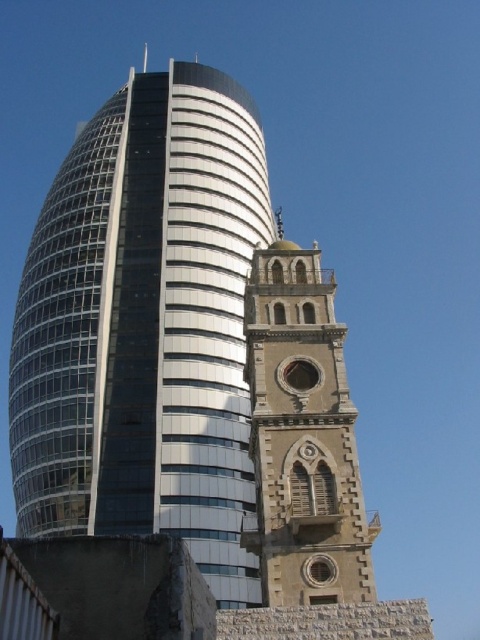
Between stone textured bell tower at center and stone gothic bell tower at center, which one appears on the right side from the viewer's perspective?

From the viewer's perspective, stone gothic bell tower at center appears more on the right side.

Is stone textured bell tower at center to the right of stone gothic bell tower at center from the viewer's perspective?

Incorrect, stone textured bell tower at center is not on the right side of stone gothic bell tower at center.

Which is in front, point (59, 209) or point (283, 502)?

Point (283, 502) is more forward.

You are a GUI agent. You are given a task and a screenshot of the screen. Output one action in this format:
    pyautogui.click(x=<x>, y=<y>)
    Task: Click on the stone textured bell tower at center
    This screenshot has height=640, width=480.
    Given the screenshot: What is the action you would take?
    pyautogui.click(x=144, y=326)